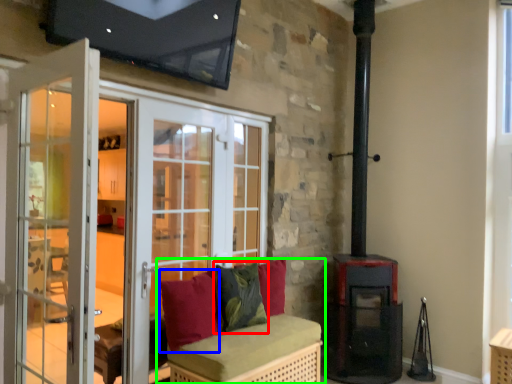
Question: Which object is the closest to the pillow (highlighted by a red box)? Choose among these: pillow (highlighted by a blue box) or furniture (highlighted by a green box).

Choices:
 (A) pillow
 (B) furniture

Answer: (B)